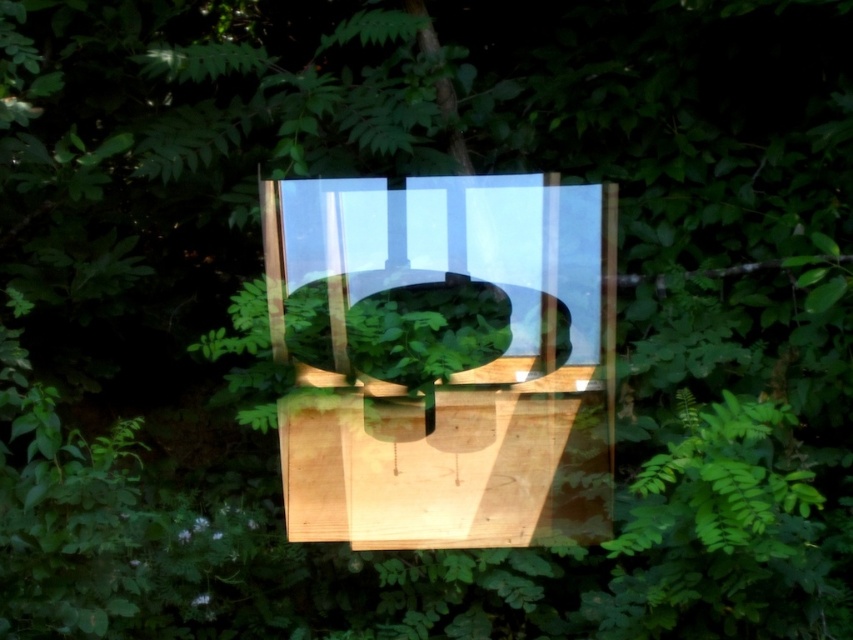
Question: Can you confirm if transparent glass plate at center is positioned to the left of green matte bowl at center?

Choices:
 (A) no
 (B) yes

Answer: (A)

Question: Which point is farther to the camera?

Choices:
 (A) transparent glass plate at center
 (B) green matte bowl at center

Answer: (A)

Question: From the image, what is the correct spatial relationship of transparent glass plate at center in relation to green matte bowl at center?

Choices:
 (A) left
 (B) right

Answer: (B)

Question: Among these points, which one is farthest from the camera?

Choices:
 (A) (425, 362)
 (B) (592, 332)

Answer: (B)

Question: In this image, where is transparent glass plate at center located relative to green matte bowl at center?

Choices:
 (A) above
 (B) below

Answer: (A)

Question: Which point is farther to the camera?

Choices:
 (A) (396, 310)
 (B) (308, 212)

Answer: (B)